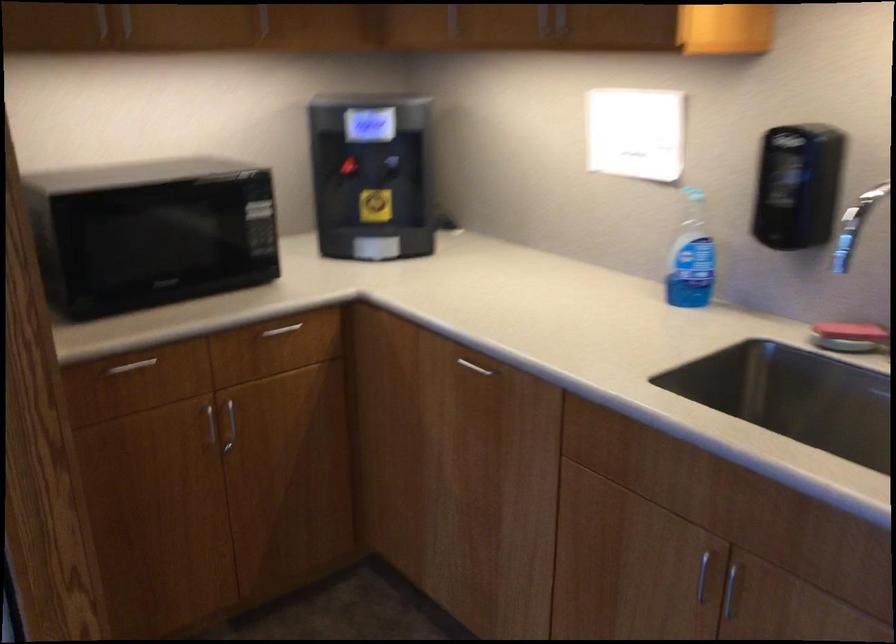
The width and height of the screenshot is (896, 644). Describe the element at coordinates (691, 257) in the screenshot. I see `the blue soap bottle` at that location.